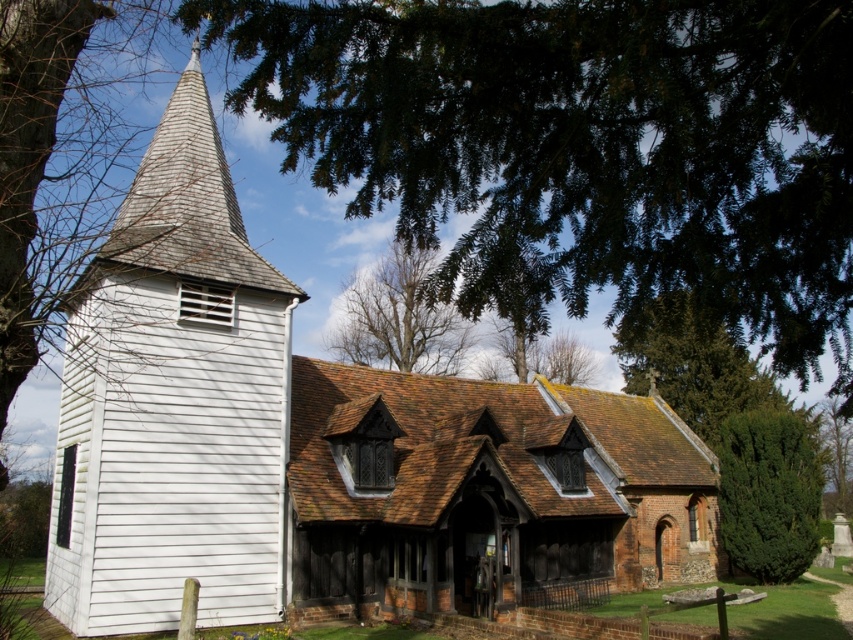
Image resolution: width=853 pixels, height=640 pixels. Describe the element at coordinates (582, 145) in the screenshot. I see `green leafy tree at upper center` at that location.

Is green leafy tree at upper center smaller than bare branches at center?

No.

Which is in front, point (358, 88) or point (358, 358)?

Point (358, 88)

The height and width of the screenshot is (640, 853). Identify the location of green leafy tree at upper center. (582, 145).

Between point (415, 317) and point (833, 452), which one is positioned behind?

The point (833, 452) is behind.

Does bare branches at center have a larger size compared to green leafy tree at right?

Yes, bare branches at center is bigger than green leafy tree at right.

Where is `bare branches at center`? bare branches at center is located at coordinates (399, 317).

At what (x,y) coordinates should I click in order to perform the action: click on bare branches at center. Please return your answer as a coordinate pair (x, y). The image size is (853, 640). Looking at the image, I should click on (399, 317).

Does green leafy tree at upper center have a smaller size compared to green leafy tree at right?

Incorrect, green leafy tree at upper center is not smaller in size than green leafy tree at right.

Based on the photo, between green leafy tree at upper center and green leafy tree at right, which one has more height?

With more height is green leafy tree at upper center.

Between point (677, 32) and point (830, 413), which one is positioned in front?

Point (677, 32) is in front.

Where is `green leafy tree at upper center`? Image resolution: width=853 pixels, height=640 pixels. green leafy tree at upper center is located at coordinates click(582, 145).